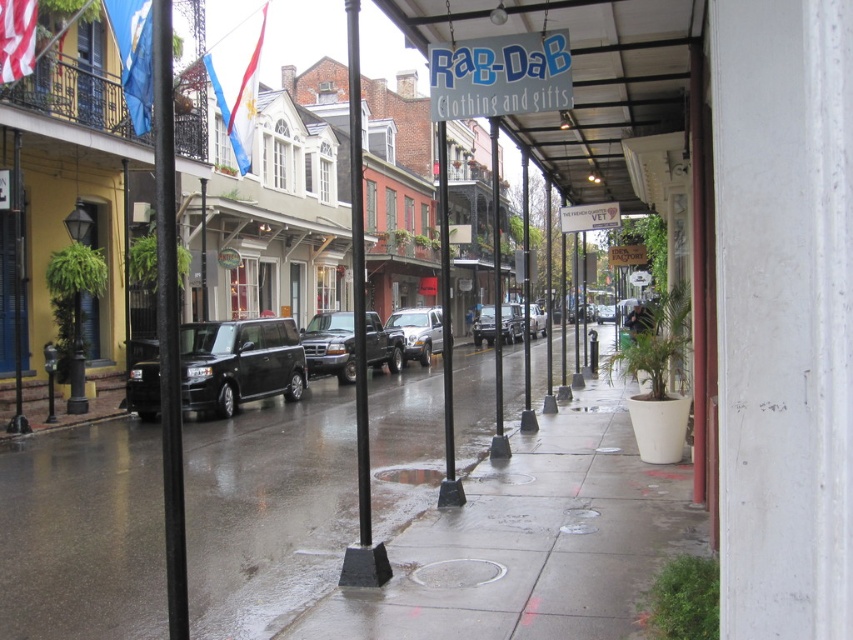
You are standing on the glossy concrete sidewalk at center. Where exactly are you located in the scene?

You are located at point (267, 509) on the glossy concrete sidewalk at center.

You are a delivery driver in a car that is 5 meters long. You are approaching the silver metallic truck at center on a wet street in a historic district. There is a stop sign 30 meters ahead of your current position. Can you safely stop your car before hitting the truck if you need to maintain a 2 meter buffer zone behind it?

The silver metallic truck at center is 27.35 meters away from the camera. Since the stop sign is 30 meters ahead, the distance between your car and the truck is less than the required stopping distance needed to maintain a 2 meter buffer. Therefore, you cannot safely stop before hitting the truck.

You are a delivery driver trying to navigate through the wet street in the historic district. Your GPS says to turn left at the next intersection, but you see a silver metallic truck at center blocking the path. Can you safely make the left turn around the truck without crossing into the oncoming traffic lane?

The silver metallic truck at center is located at coordinates approximately 0.519 on the x and y axis. Since it is centrally positioned, there may be space on either side to maneuver around it, but without knowing the truck size or lane width, it is unsafe to assume you can turn left without crossing into oncoming traffic. Proceed with caution or wait for the truck to move.